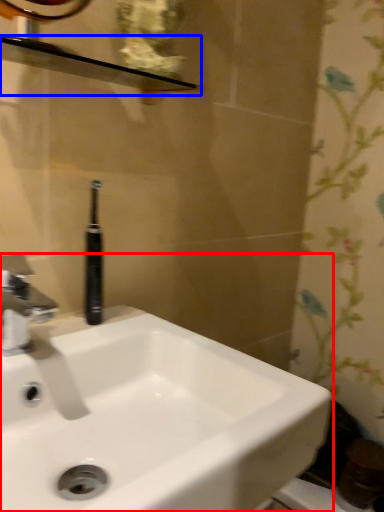
Question: Which object appears closest to the camera in this image, sink (highlighted by a red box) or balustrade (highlighted by a blue box)?

Choices:
 (A) sink
 (B) balustrade

Answer: (A)